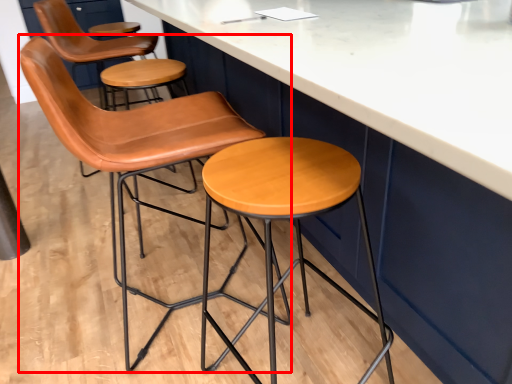
Question: From the image's perspective, what is the correct spatial relationship of chair (annotated by the red box) in relation to stool?

Choices:
 (A) below
 (B) above

Answer: (B)